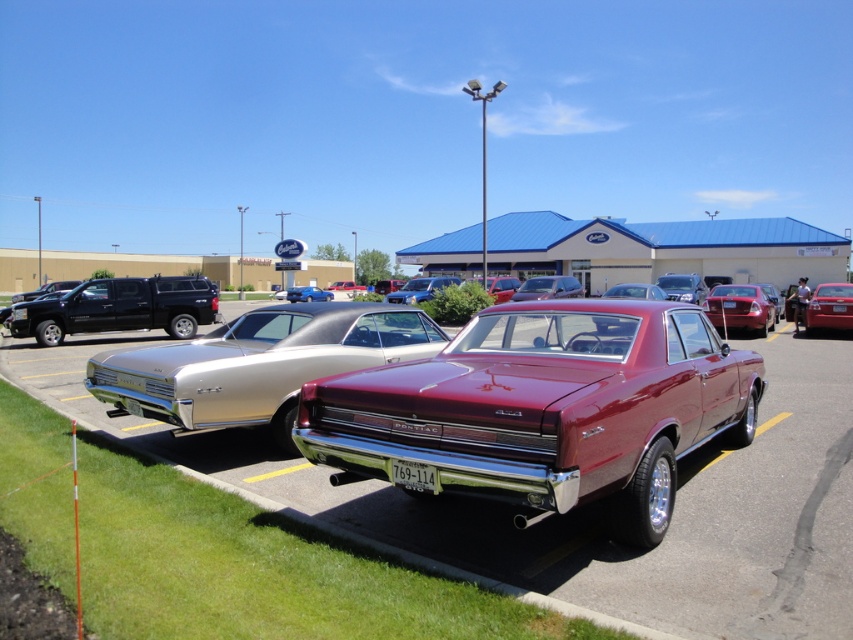
You are a photographer setting up a tripod to capture both the metallic red sedan at center and the glossy blue sedan at center in the parking lot. Since you want to ensure both cars are fully visible in your shot, which car will require you to adjust the camera angle upwards more to include its full height?

The metallic red sedan at center is much taller than the glossy blue sedan at center, so you will need to adjust the camera angle upwards more to include the full height of the metallic red sedan at center.

You are standing at the point with coordinates point (405, 282) and want to walk to the car on the left. Is the point (843, 284) between you and the car on the left?

Yes, the point (843, 284) is between you and the car on the left because the point (843, 284) is in front of point (405, 282).